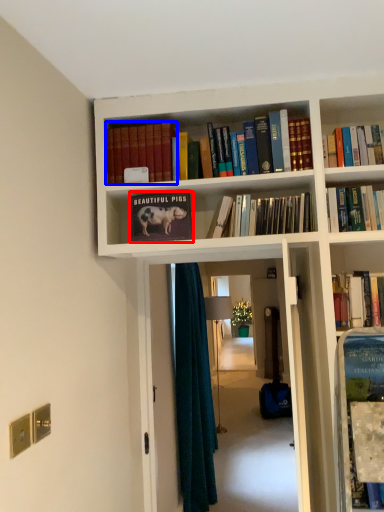
Question: Among these objects, which one is farthest to the camera, book (highlighted by a red box) or book (highlighted by a blue box)?

Choices:
 (A) book
 (B) book

Answer: (B)